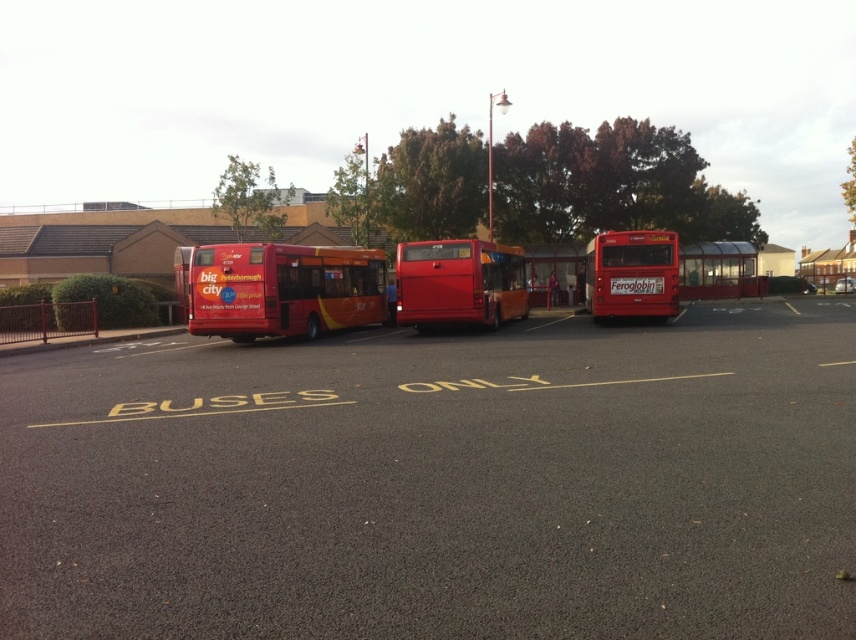
Does shiny red bus at center have a greater height compared to metallic red bus stop at center?

Yes, shiny red bus at center is taller than metallic red bus stop at center.

Is shiny red bus at center to the right of metallic red bus stop at center from the viewer's perspective?

No, shiny red bus at center is not to the right of metallic red bus stop at center.

Between point (468, 253) and point (528, 246), which one is positioned in front?

Point (468, 253) is in front.

This screenshot has height=640, width=856. I want to click on shiny red bus at center, so click(x=459, y=282).

Which is more to the left, matte red bus at center or matte red bus at left?

matte red bus at left is more to the left.

Locate an element on the screen. This screenshot has height=640, width=856. matte red bus at center is located at coordinates (283, 289).

Does matte red bus at center have a smaller size compared to matte red bus at right?

Indeed, matte red bus at center has a smaller size compared to matte red bus at right.

Which of these two, matte red bus at center or matte red bus at right, stands taller?

With more height is matte red bus at right.

At what (x,y) coordinates should I click in order to perform the action: click on matte red bus at center. Please return your answer as a coordinate pair (x, y). Looking at the image, I should click on (283, 289).